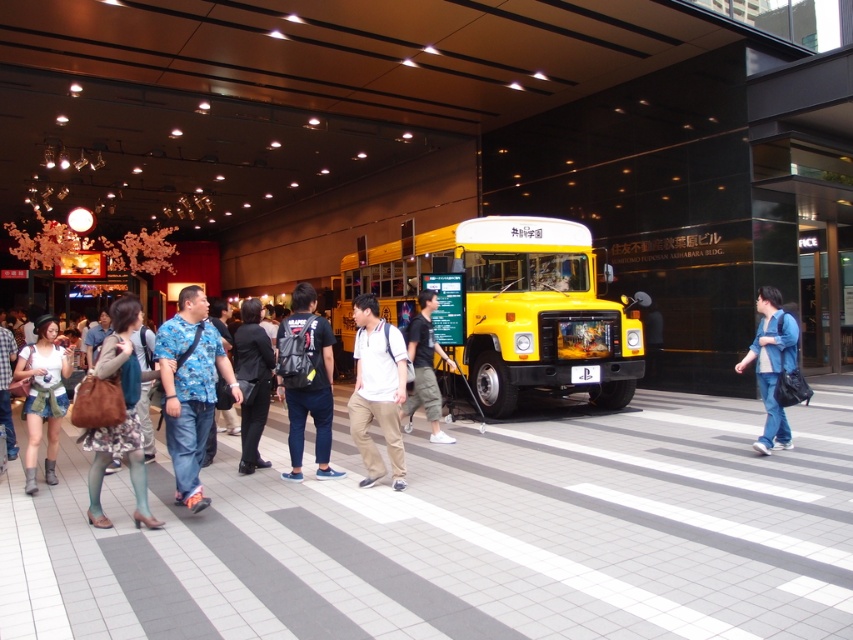
Question: Which object appears closest to the camera in this image?

Choices:
 (A) blue denim jeans at center
 (B) black fabric pants at center
 (C) denim shorts at center
 (D) white matte shirt at center

Answer: (D)

Question: Which point appears closest to the camera in this image?

Choices:
 (A) (332, 372)
 (B) (114, 449)
 (C) (572, 230)
 (D) (364, 300)

Answer: (B)

Question: Can you confirm if black matte backpack at center is positioned above denim shorts at center?

Choices:
 (A) yes
 (B) no

Answer: (A)

Question: Which point is farther from the camera taking this photo?

Choices:
 (A) (216, 337)
 (B) (425, 372)

Answer: (B)

Question: Is blue floral shirt at center wider than black fabric pants at center?

Choices:
 (A) yes
 (B) no

Answer: (A)

Question: Is white matte shirt at center closer to camera compared to dark gray fabric pants at center?

Choices:
 (A) no
 (B) yes

Answer: (B)